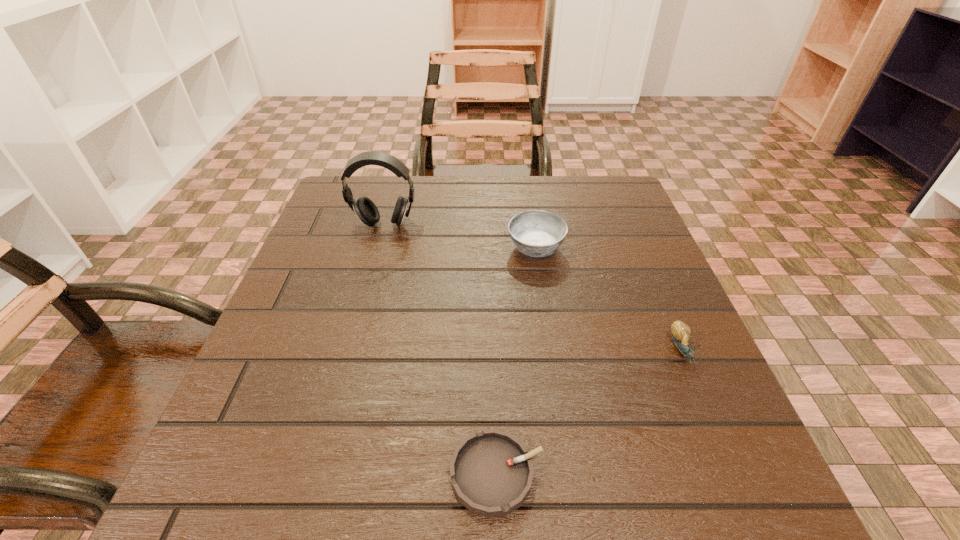
You are a GUI agent. You are given a task and a screenshot of the screen. Output one action in this format:
    pyautogui.click(x=<x>, y=<y>)
    Task: Click on the vacant space at the right edge of the desktop
    This screenshot has width=960, height=540.
    Given the screenshot: What is the action you would take?
    pyautogui.click(x=647, y=322)

Where is `vacant space at the near left corner of the desktop`? The width and height of the screenshot is (960, 540). vacant space at the near left corner of the desktop is located at coordinates (277, 484).

Locate an element on the screen. This screenshot has height=540, width=960. free space at the far right corner of the desktop is located at coordinates (633, 213).

The height and width of the screenshot is (540, 960). I want to click on vacant point at the near right corner, so click(749, 481).

The height and width of the screenshot is (540, 960). I want to click on free spot between the tallest object and the shorter ashtray, so click(441, 349).

Where is `empty space that is in between the leftmost object and the third shortest object`? empty space that is in between the leftmost object and the third shortest object is located at coordinates (460, 237).

Find the location of a particular element. The image size is (960, 540). empty space that is in between the rightmost object and the leftmost object is located at coordinates (533, 287).

Identify the location of empty space between the leftmost object and the shorter ashtray. This screenshot has height=540, width=960. (441, 349).

The width and height of the screenshot is (960, 540). What are the coordinates of `empty space between the farther ashtray and the shorter ashtray` in the screenshot? It's located at (516, 361).

Find the location of a particular element. This screenshot has width=960, height=540. unoccupied area between the taller ashtray and the nearer ashtray is located at coordinates pyautogui.click(x=516, y=361).